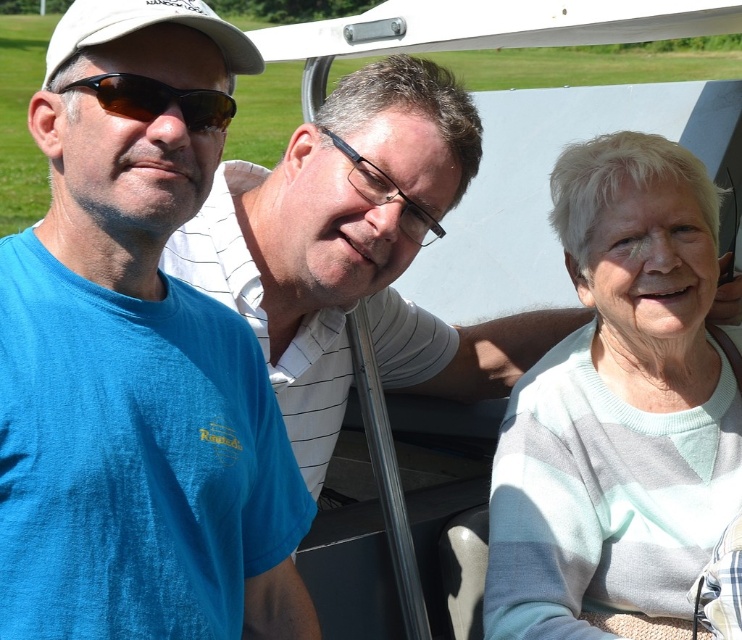
Between blue cotton t-shirt at left and brown reflective sunglasses at left, which one appears on the left side from the viewer's perspective?

Positioned to the left is blue cotton t-shirt at left.

Is blue cotton t-shirt at left behind brown reflective sunglasses at left?

That is False.

What are the coordinates of `blue cotton t-shirt at left` in the screenshot? It's located at click(137, 360).

Locate an element on the screen. This screenshot has height=640, width=742. blue cotton t-shirt at left is located at coordinates (137, 360).

Who is higher up, blue cotton t-shirt at left or white knit sweater at right?

blue cotton t-shirt at left

Can you confirm if blue cotton t-shirt at left is bigger than white knit sweater at right?

Correct, blue cotton t-shirt at left is larger in size than white knit sweater at right.

Between point (50, 433) and point (643, 177), which one is positioned behind?

Positioned behind is point (643, 177).

Where is `blue cotton t-shirt at left`? The height and width of the screenshot is (640, 742). blue cotton t-shirt at left is located at coordinates (137, 360).

Between blue cotton t-shirt at left and black plastic glasses at center, which one is positioned lower?

blue cotton t-shirt at left is below.

The width and height of the screenshot is (742, 640). Find the location of `blue cotton t-shirt at left`. blue cotton t-shirt at left is located at coordinates (137, 360).

Is point (65, 179) positioned behind point (349, 157)?

No, it is in front of (349, 157).

Where is `blue cotton t-shirt at left`? The width and height of the screenshot is (742, 640). blue cotton t-shirt at left is located at coordinates [137, 360].